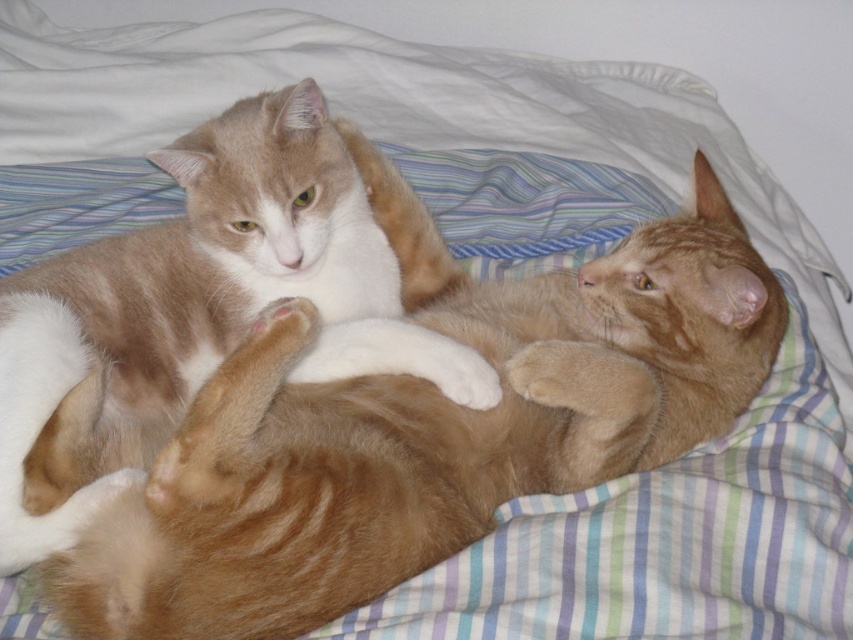
Question: Which point appears farthest from the camera in this image?

Choices:
 (A) (93, 614)
 (B) (201, 189)

Answer: (B)

Question: Is orange fur cat at upper left closer to camera compared to orange tabby cat at center?

Choices:
 (A) yes
 (B) no

Answer: (A)

Question: Which point is closer to the camera?

Choices:
 (A) orange fur cat at upper left
 (B) orange tabby cat at center

Answer: (A)

Question: Is orange fur cat at upper left closer to the viewer compared to orange tabby cat at center?

Choices:
 (A) yes
 (B) no

Answer: (A)

Question: Is orange fur cat at upper left smaller than orange tabby cat at center?

Choices:
 (A) yes
 (B) no

Answer: (B)